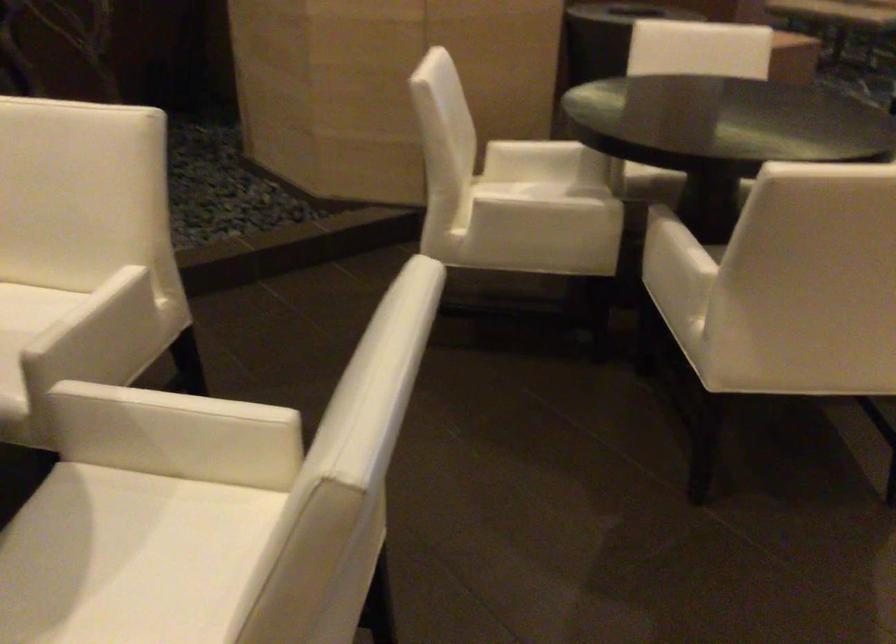
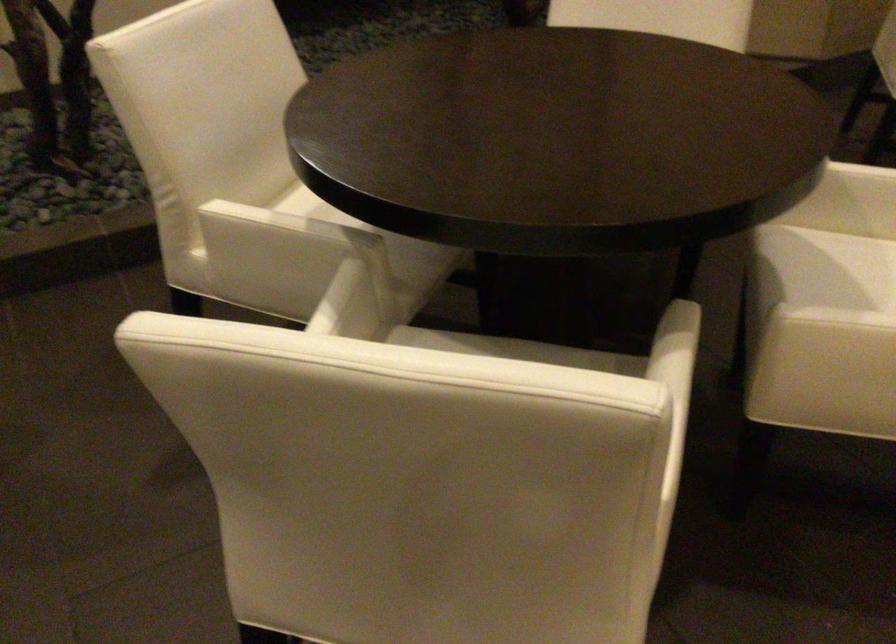
Question: I am providing you with two images of the same scene from different viewpoints. Please identify which objects are invisible in image2.

Choices:
 (A) chair sitting surface
 (B) white chair sitting surface
 (C) red handle screwdriver
 (D) white chair armrest

Answer: (B)